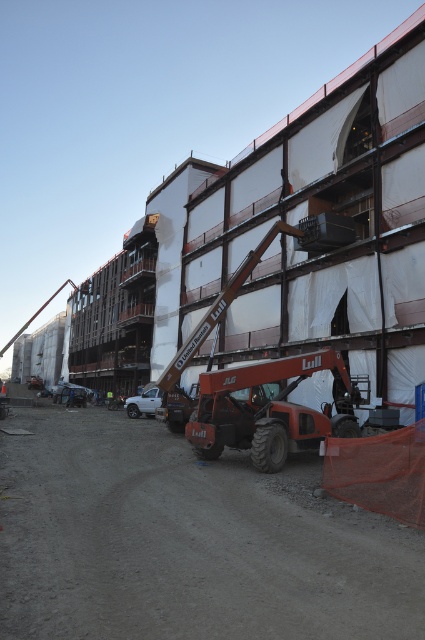
Who is more distant from viewer, (257, 490) or (297, 436)?

The point (297, 436) is behind.

Can you confirm if dirt track at center is positioned to the right of orange metallic trailer truck at center?

In fact, dirt track at center is to the left of orange metallic trailer truck at center.

Is point (181, 636) farther from viewer compared to point (243, 419)?

That is False.

This screenshot has height=640, width=425. I want to click on dirt track at center, so click(x=187, y=541).